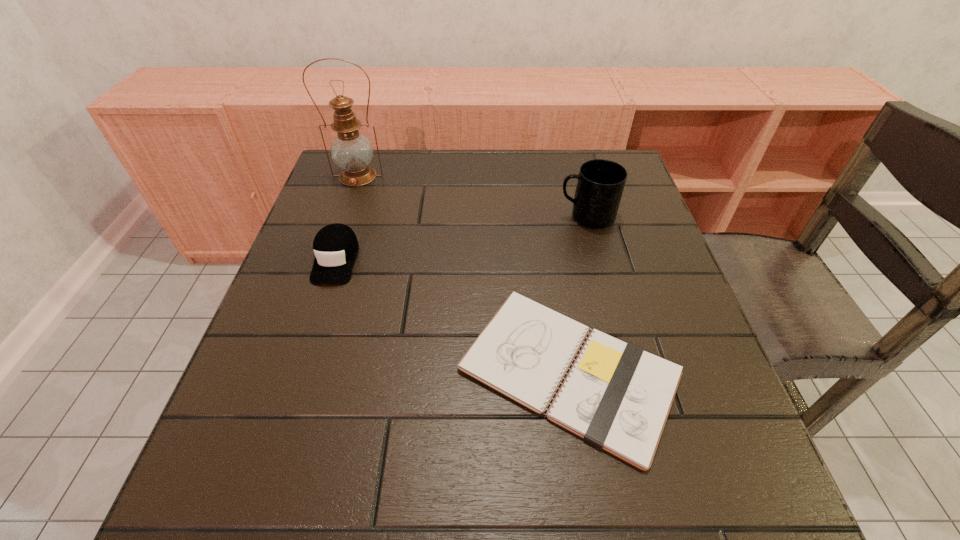
Locate an element on the screen. Image resolution: width=960 pixels, height=540 pixels. free region located on the side of the third shortest object with the handle is located at coordinates (448, 217).

Image resolution: width=960 pixels, height=540 pixels. What are the coordinates of `free spot located 0.130m on the side of the third shortest object with the handle` in the screenshot? It's located at click(x=505, y=217).

Where is `vacant region located 0.280m on the front-facing side of the cap`? This screenshot has height=540, width=960. vacant region located 0.280m on the front-facing side of the cap is located at coordinates (287, 410).

Identify the location of free space located 0.120m on the back of the notepad. (550, 256).

I want to click on object located in the far edge section of the desktop, so click(x=351, y=151).

Locate an element on the screen. object situated at the near edge is located at coordinates (616, 396).

Find the location of a particular element. The image size is (960, 540). oil lamp located in the left edge section of the desktop is located at coordinates click(351, 151).

Find the location of a particular element. cap that is positioned at the left edge is located at coordinates (335, 246).

Locate an element on the screen. mug located at the right edge is located at coordinates (601, 182).

Find the location of a particular element. The width and height of the screenshot is (960, 540). notepad situated at the right edge is located at coordinates (616, 396).